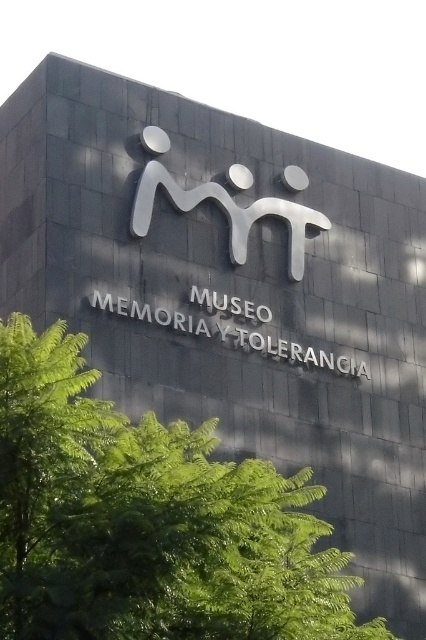
Can you confirm if green leafy tree at center is positioned to the left of sleek silver logo at center?

Indeed, green leafy tree at center is positioned on the left side of sleek silver logo at center.

Between green leafy tree at center and sleek silver logo at center, which one appears on the right side from the viewer's perspective?

From the viewer's perspective, sleek silver logo at center appears more on the right side.

At what (x,y) coordinates should I click in order to perform the action: click on green leafy tree at center. Please return your answer as a coordinate pair (x, y). The width and height of the screenshot is (426, 640). Looking at the image, I should click on (147, 520).